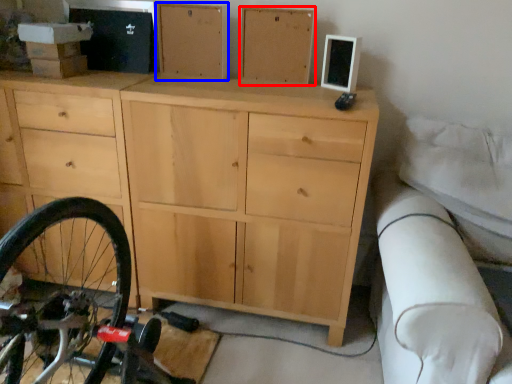
Question: Among these objects, which one is farthest to the camera, chest of drawer (highlighted by a red box) or chest of drawer (highlighted by a blue box)?

Choices:
 (A) chest of drawer
 (B) chest of drawer

Answer: (B)